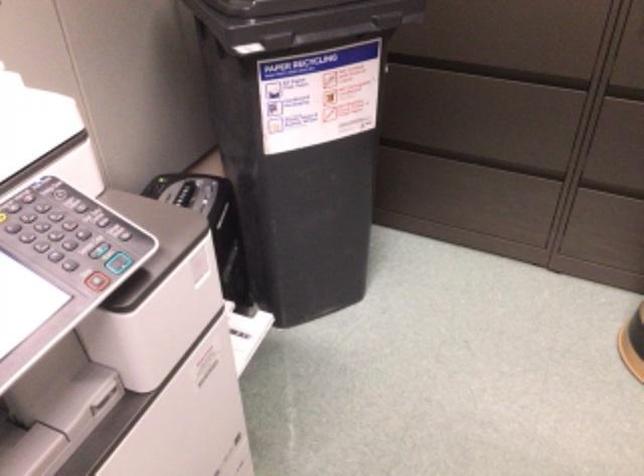
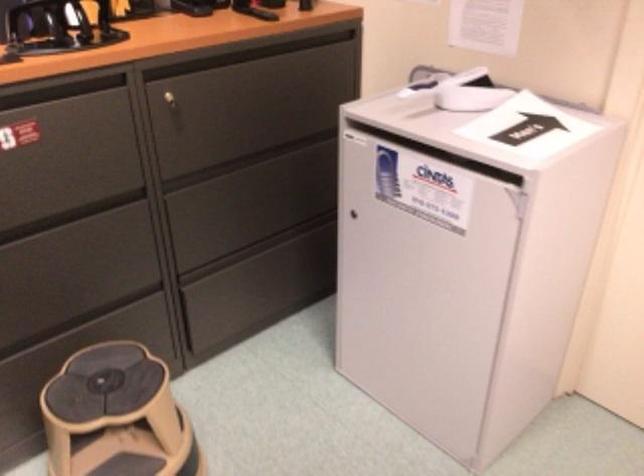
Question: Based on the continuous images, in which direction is the camera rotating? Reply with the corresponding letter.

Choices:
 (A) Left
 (B) Right
 (C) Up
 (D) Down

Answer: (B)